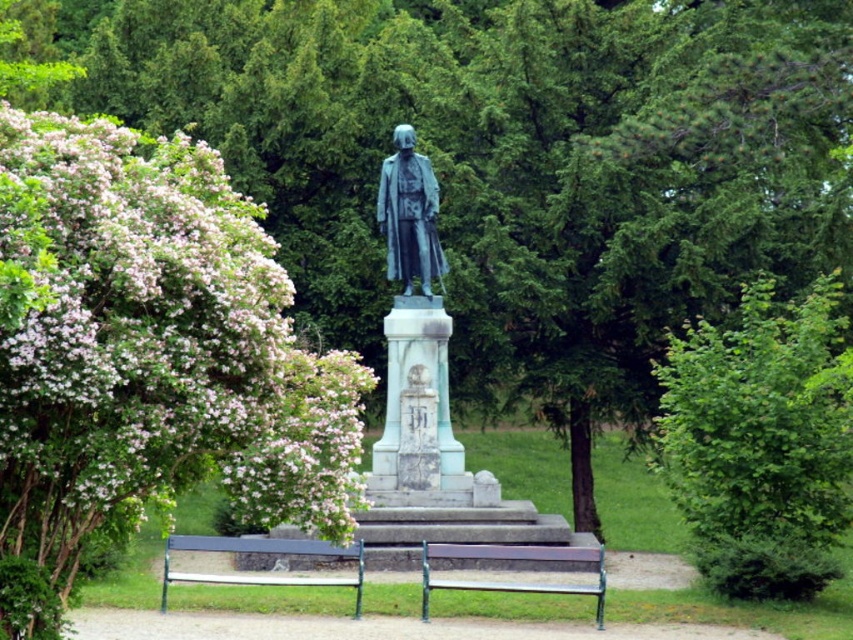
Which of these two, green polished stone statue at center or wooden bench at center, stands taller?

Standing taller between the two is green polished stone statue at center.

Who is more forward, (x=416, y=300) or (x=480, y=589)?

Point (x=480, y=589) is more forward.

This screenshot has width=853, height=640. What do you see at coordinates (415, 332) in the screenshot?
I see `green polished stone statue at center` at bounding box center [415, 332].

This screenshot has width=853, height=640. Find the location of `green polished stone statue at center`. green polished stone statue at center is located at coordinates (415, 332).

Can you confirm if green leafy bush at upper right is taller than green polished stone statue at center?

No.

Does point (735, 422) lie behind point (448, 465)?

No, (735, 422) is in front of (448, 465).

The image size is (853, 640). I want to click on green leafy bush at upper right, so tap(759, 442).

Is bronze statue at center bigger than wooden bench at center?

No, bronze statue at center is not bigger than wooden bench at center.

Can you confirm if bronze statue at center is positioned below wooden bench at center?

Actually, bronze statue at center is above wooden bench at center.

Between point (410, 257) and point (577, 586), which one is positioned in front?

Point (577, 586)

I want to click on bronze statue at center, so (409, 216).